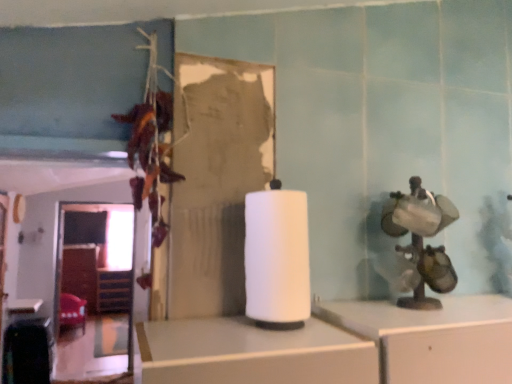
Where is `velvet red chair at lower left`? This screenshot has height=384, width=512. velvet red chair at lower left is located at coordinates (72, 311).

Does white glossy table at lower left lie behind white matte paper towel at center?

Yes, the depth of white glossy table at lower left is greater than that of white matte paper towel at center.

Is white glossy table at lower left oriented away from white matte paper towel at center?

That's not correct — white glossy table at lower left is not looking away from white matte paper towel at center.

From a real-world perspective, which is physically below, white glossy table at lower left or white matte paper towel at center?

white glossy table at lower left is physically lower.

Where is `table on the left of white matte paper towel at center`? The image size is (512, 384). table on the left of white matte paper towel at center is located at coordinates (24, 306).

Does point (71, 318) come behind point (24, 309)?

Yes, it is.

Is velvet red chair at lower left thinner than white glossy table at lower left?

In fact, velvet red chair at lower left might be wider than white glossy table at lower left.

Is velvet red chair at lower left positioned with its back to white glossy table at lower left?

No, velvet red chair at lower left's orientation is not away from white glossy table at lower left.

How many degrees apart are the facing directions of velvet red chair at lower left and white glossy table at lower left?

The angular difference between velvet red chair at lower left and white glossy table at lower left is 0.000405 degrees.

Is white glossy table at lower left facing towards wooden at left?

No, white glossy table at lower left does not turn towards wooden at left.

From the image's perspective, does white glossy table at lower left appear lower than wooden at left?

No, from the image's perspective, white glossy table at lower left is not beneath wooden at left.

Consider the image. Is white glossy table at lower left in front of or behind wooden at left in the image?

Visually, white glossy table at lower left is located in front of wooden at left.

The height and width of the screenshot is (384, 512). Identify the location of table located above the wooden at left (from the image's perspective). (24, 306).

From a real-world perspective, does white matte paper towel at center sit lower than velvet red chair at lower left?

Incorrect, from a real-world perspective, white matte paper towel at center is higher than velvet red chair at lower left.

Is velvet red chair at lower left completely or partially inside white matte paper towel at center?

No, velvet red chair at lower left is not surrounded by white matte paper towel at center.

Identify the location of chair below the white matte paper towel at center (from a real-world perspective). This screenshot has width=512, height=384. (72, 311).

Is white matte paper towel at center turned away from velvet red chair at lower left?

Correct, white matte paper towel at center is looking away from velvet red chair at lower left.

Who is bigger, wooden at left or white matte paper towel at center?

Bigger between the two is wooden at left.

Which object is positioned more to the right, wooden at left or white matte paper towel at center?

From the viewer's perspective, white matte paper towel at center appears more on the right side.

Which is less distant, (113,270) or (254,253)?

The point (254,253) is more forward.

Where is `shelf lying on the left of white matte paper towel at center`? Image resolution: width=512 pixels, height=384 pixels. shelf lying on the left of white matte paper towel at center is located at coordinates (114, 290).

Which is behind, velvet red chair at lower left or white matte paper towel at center?

velvet red chair at lower left is more distant.

Between velvet red chair at lower left and white matte paper towel at center, which one has smaller size?

Smaller between the two is white matte paper towel at center.

This screenshot has height=384, width=512. In order to click on chair behind the white matte paper towel at center in this screenshot , I will do `click(72, 311)`.

Between velvet red chair at lower left and white matte paper towel at center, which one has less height?

white matte paper towel at center is shorter.

Relative to white glossy table at lower left, is wooden at left in front or behind?

Clearly, wooden at left is behind white glossy table at lower left.

Does wooden at left have a lesser width compared to white glossy table at lower left?

Yes, wooden at left is thinner than white glossy table at lower left.

Would you consider wooden at left to be distant from white glossy table at lower left?

Yes.

From a real-world perspective, does wooden at left sit lower than white glossy table at lower left?

Yes, from a real-world perspective, wooden at left is beneath white glossy table at lower left.

The image size is (512, 384). I want to click on paper towel above the white glossy table at lower left (from a real-world perspective), so click(x=277, y=259).

Identify the location of chair behind the white glossy table at lower left. Image resolution: width=512 pixels, height=384 pixels. (72, 311).

When comparing their distances from white glossy table at lower left, does white matte paper towel at center or velvet red chair at lower left seem closer?

Based on the image, velvet red chair at lower left appears to be nearer to white glossy table at lower left.

Which object lies further to the anchor point wooden at left, white glossy table at lower left or velvet red chair at lower left?

white glossy table at lower left.

From the image, which object appears to be nearer to white matte paper towel at center, white glossy table at lower left or velvet red chair at lower left?

white glossy table at lower left.

Based on their spatial positions, is white matte paper towel at center or white glossy table at lower left further from velvet red chair at lower left?

Based on the image, white matte paper towel at center appears to be further to velvet red chair at lower left.

Looking at the image, which one is located closer to wooden at left, velvet red chair at lower left or white glossy table at lower left?

Based on the image, velvet red chair at lower left appears to be nearer to wooden at left.

Looking at the image, which one is located further to white matte paper towel at center, velvet red chair at lower left or wooden at left?

wooden at left is positioned further to the anchor white matte paper towel at center.

When comparing their distances from velvet red chair at lower left, does white glossy table at lower left or wooden at left seem further?

white glossy table at lower left is further to velvet red chair at lower left.

When comparing their distances from velvet red chair at lower left, does wooden at left or white glossy table at lower left seem closer?

wooden at left.

Find the location of `chair between white glossy table at lower left and wooden at left along the z-axis`. chair between white glossy table at lower left and wooden at left along the z-axis is located at coordinates (72, 311).

At what (x,y) coordinates should I click in order to perform the action: click on table between white matte paper towel at center and wooden at left from front to back. Please return your answer as a coordinate pair (x, y). The height and width of the screenshot is (384, 512). Looking at the image, I should click on (24, 306).

At what (x,y) coordinates should I click in order to perform the action: click on table between white matte paper towel at center and velvet red chair at lower left in the front-back direction. Please return your answer as a coordinate pair (x, y). Looking at the image, I should click on (24, 306).

Image resolution: width=512 pixels, height=384 pixels. Identify the location of chair between white matte paper towel at center and wooden at left along the z-axis. (72, 311).